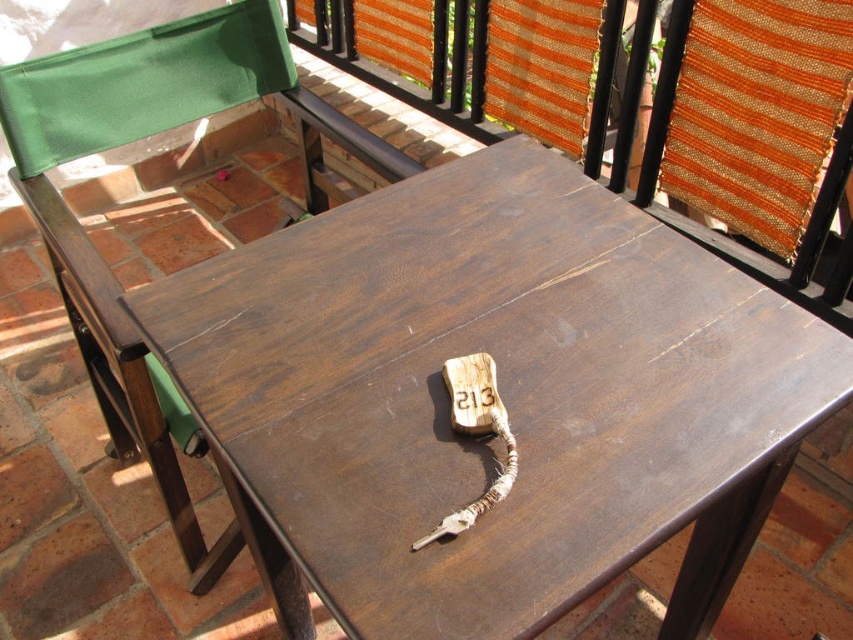
Which of these two, dark wood keychain at center or green fabric cushion at upper left, stands shorter?

dark wood keychain at center is shorter.

Does point (276, 260) lie behind point (228, 72)?

No, it is in front of (228, 72).

Between point (341, 241) and point (65, 252), which one is positioned in front?

Point (341, 241) is in front.

I want to click on dark wood keychain at center, so click(502, 396).